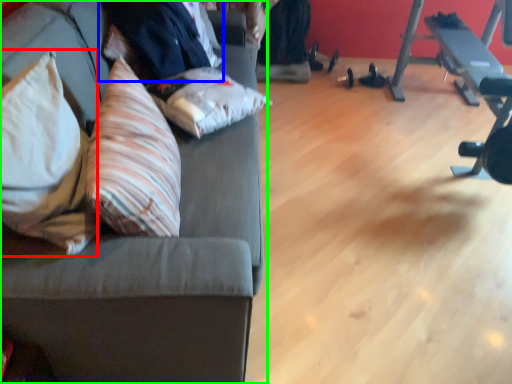
Question: Which object is positioned farthest from throw pillow (highlighted by a red box)? Select from businessman (highlighted by a blue box) and studio couch (highlighted by a green box).

Choices:
 (A) businessman
 (B) studio couch

Answer: (A)